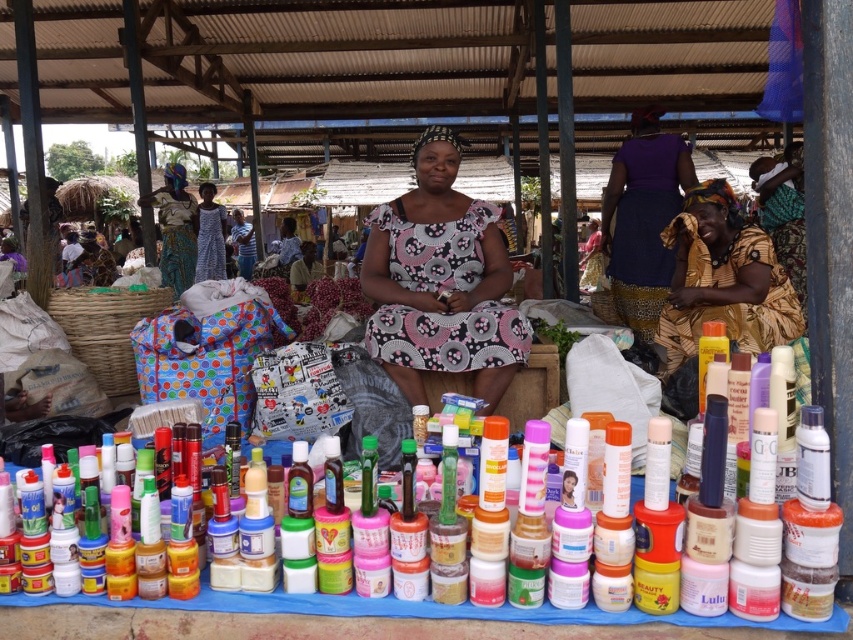
Question: Considering the relative positions of matte plastic bottles at center and matte blue fabric headscarf at upper left in the image provided, where is matte plastic bottles at center located with respect to matte blue fabric headscarf at upper left?

Choices:
 (A) above
 (B) below

Answer: (B)

Question: Which point is farther to the camera?

Choices:
 (A) purple fabric skirt at upper right
 (B) patterned fabric headscarf at upper right
 (C) patterned fabric dress at center

Answer: (A)

Question: Does patterned fabric headscarf at upper right appear over matte blue dress at center?

Choices:
 (A) no
 (B) yes

Answer: (A)

Question: Which of these objects is positioned farthest from the patterned fabric dress at center?

Choices:
 (A) patterned fabric headscarf at upper right
 (B) matte plastic bottles at center
 (C) matte blue fabric headscarf at upper left

Answer: (C)

Question: Can you confirm if purple fabric skirt at upper right is positioned above matte blue fabric headscarf at upper left?

Choices:
 (A) no
 (B) yes

Answer: (A)

Question: Which point is closer to the camera?

Choices:
 (A) patterned fabric headscarf at upper right
 (B) matte blue dress at center
 (C) matte plastic bottles at center
 (D) patterned fabric dress at center

Answer: (C)